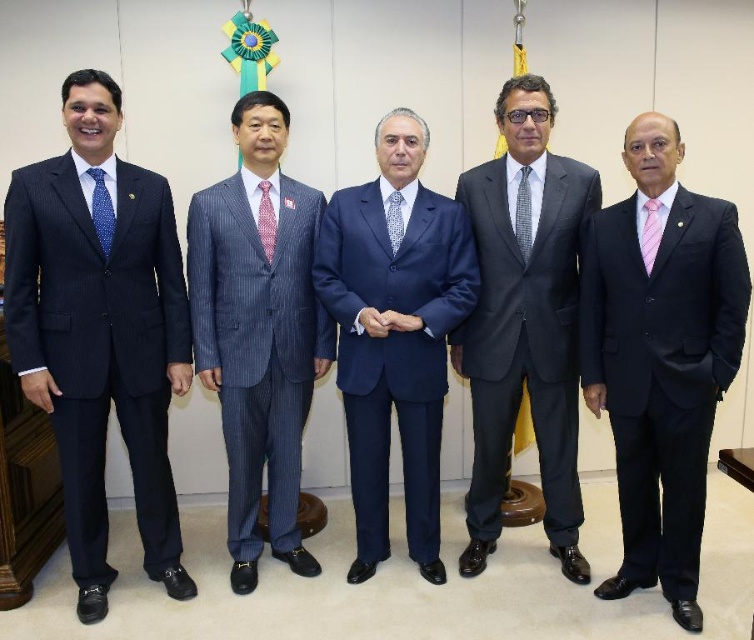
You are a photographer preparing to take a group photo of the five men. You notice the matte blue suit at left and the blue dotted tie at left. Which one should you focus on first if you want to ensure both are in sharp focus?

The matte blue suit at left is bigger than the blue dotted tie at left, so focusing on the matte blue suit at left first will ensure both are in sharp focus since it is larger and likely farther away.

You are a photographer adjusting the camera focus for a group photo. The subjects include a dark gray suit at center and a gray checkered tie at center. Which object should you focus on first to ensure proper framing, considering their relative sizes?

The dark gray suit at center has a greater height compared to the gray checkered tie at center, so you should focus on the dark gray suit at center first to ensure proper framing.